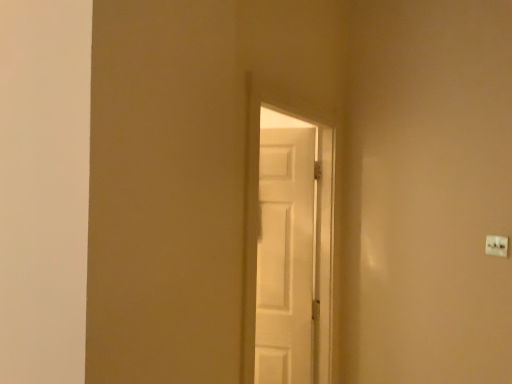
What do you see at coordinates (288, 247) in the screenshot?
I see `white matte door at center` at bounding box center [288, 247].

The image size is (512, 384). Find the location of `white matte door at center`. white matte door at center is located at coordinates (288, 247).

I want to click on white plastic light switch at upper right, so click(x=496, y=245).

What do you see at coordinates (496, 245) in the screenshot?
I see `white plastic light switch at upper right` at bounding box center [496, 245].

Measure the distance between white plastic light switch at upper right and camera.

A distance of 6.36 feet exists between white plastic light switch at upper right and camera.

You are a GUI agent. You are given a task and a screenshot of the screen. Output one action in this format:
    pyautogui.click(x=<x>, y=<y>)
    Task: Click on the white matte door at center
    Image resolution: width=512 pixels, height=384 pixels.
    Given the screenshot: What is the action you would take?
    pyautogui.click(x=288, y=247)

Which is more to the left, white matte door at center or white plastic light switch at upper right?

From the viewer's perspective, white matte door at center appears more on the left side.

Is white matte door at center positioned behind white plastic light switch at upper right?

No, it is not.

Between point (274, 278) and point (499, 246), which one is positioned behind?

The point (274, 278) is farther.

From the image's perspective, between white matte door at center and white plastic light switch at upper right, who is located below?

white matte door at center appears lower in the image.

From a real-world perspective, is white matte door at center physically below white plastic light switch at upper right?

Yes.

Considering the relative sizes of white matte door at center and white plastic light switch at upper right in the image provided, is white matte door at center wider than white plastic light switch at upper right?

Indeed, white matte door at center has a greater width compared to white plastic light switch at upper right.

Considering the sizes of objects white matte door at center and white plastic light switch at upper right in the image provided, who is shorter, white matte door at center or white plastic light switch at upper right?

Standing shorter between the two is white plastic light switch at upper right.

Based on the photo, can you confirm if white matte door at center is bigger than white plastic light switch at upper right?

Indeed, white matte door at center has a larger size compared to white plastic light switch at upper right.

Is white matte door at center located outside white plastic light switch at upper right?

Yes, white matte door at center is located beyond the bounds of white plastic light switch at upper right.

Is the surface of white matte door at center in direct contact with white plastic light switch at upper right?

white matte door at center and white plastic light switch at upper right are not in contact.

Is white matte door at center aimed at white plastic light switch at upper right?

Yes, white matte door at center is oriented towards white plastic light switch at upper right.

What's the angular difference between white matte door at center and white plastic light switch at upper right's facing directions?

93.8 degrees.

What are the coordinates of `door on the left of white plastic light switch at upper right` in the screenshot? It's located at (288, 247).

Can you confirm if white plastic light switch at upper right is positioned to the right of white matte door at center?

Yes.

Which object is further away from the camera, white plastic light switch at upper right or white matte door at center?

white plastic light switch at upper right is more distant.

Which is less distant, (x=499, y=245) or (x=256, y=183)?

Point (x=499, y=245) appears to be farther away from the viewer than point (x=256, y=183).

From the image's perspective, which is above, white plastic light switch at upper right or white matte door at center?

white plastic light switch at upper right is shown above in the image.

From a real-world perspective, is white plastic light switch at upper right above or below white matte door at center?

Clearly, from a real-world perspective, white plastic light switch at upper right is above white matte door at center.

Can you confirm if white plastic light switch at upper right is thinner than white matte door at center?

Correct, the width of white plastic light switch at upper right is less than that of white matte door at center.

Considering the sizes of objects white plastic light switch at upper right and white matte door at center in the image provided, who is taller, white plastic light switch at upper right or white matte door at center?

white matte door at center.

Is white plastic light switch at upper right bigger than white matte door at center?

Actually, white plastic light switch at upper right might be smaller than white matte door at center.

Is white matte door at center completely or partially inside white plastic light switch at upper right?

Definitely not — white matte door at center is not inside white plastic light switch at upper right.

Are white plastic light switch at upper right and white matte door at center located far from each other?

Yes, white plastic light switch at upper right is far from white matte door at center.

Is white plastic light switch at upper right oriented towards white matte door at center?

No, white plastic light switch at upper right is not facing towards white matte door at center.

Measure the distance from white plastic light switch at upper right to white matte door at center.

1.01 meters.

You are a GUI agent. You are given a task and a screenshot of the screen. Output one action in this format:
    pyautogui.click(x=<x>, y=<y>)
    Task: Click on the light switch behind the white matte door at center
    Image resolution: width=512 pixels, height=384 pixels.
    Given the screenshot: What is the action you would take?
    pyautogui.click(x=496, y=245)

In the image, there is a white plastic light switch at upper right. At what (x,y) coordinates should I click in order to perform the action: click on door below it (from a real-world perspective). Please return your answer as a coordinate pair (x, y). Image resolution: width=512 pixels, height=384 pixels. Looking at the image, I should click on (288, 247).

Locate an element on the screen. The image size is (512, 384). light switch lying on the right of white matte door at center is located at coordinates (496, 245).